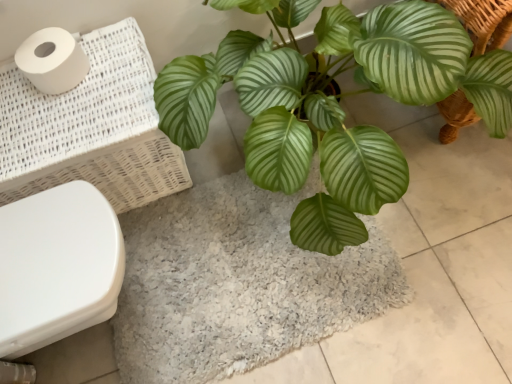
Question: Considering the relative positions of white glossy toilet bowl at lower left and white woven laundry basket at left in the image provided, is white glossy toilet bowl at lower left to the right of white woven laundry basket at left from the viewer's perspective?

Choices:
 (A) yes
 (B) no

Answer: (A)

Question: Can you confirm if white glossy toilet bowl at lower left is shorter than white woven laundry basket at left?

Choices:
 (A) yes
 (B) no

Answer: (A)

Question: From the image's perspective, is white glossy toilet bowl at lower left over white woven laundry basket at left?

Choices:
 (A) no
 (B) yes

Answer: (A)

Question: Could you tell me if white glossy toilet bowl at lower left is turned towards white woven laundry basket at left?

Choices:
 (A) yes
 (B) no

Answer: (B)

Question: Considering the relative sizes of white glossy toilet bowl at lower left and white woven laundry basket at left in the image provided, is white glossy toilet bowl at lower left thinner than white woven laundry basket at left?

Choices:
 (A) yes
 (B) no

Answer: (B)

Question: Considering the positions of white glossy toilet bowl at lower left and white woven laundry basket at left in the image, is white glossy toilet bowl at lower left bigger or smaller than white woven laundry basket at left?

Choices:
 (A) big
 (B) small

Answer: (B)

Question: Would you say white glossy toilet bowl at lower left is to the left or to the right of white woven laundry basket at left in the picture?

Choices:
 (A) left
 (B) right

Answer: (B)

Question: From a real-world perspective, is white glossy toilet bowl at lower left physically located above or below white woven laundry basket at left?

Choices:
 (A) above
 (B) below

Answer: (B)

Question: In terms of width, does white glossy toilet bowl at lower left look wider or thinner when compared to white woven laundry basket at left?

Choices:
 (A) thin
 (B) wide

Answer: (B)

Question: Considering the positions of white woven laundry basket at left and white glossy toilet bowl at lower left in the image, is white woven laundry basket at left taller or shorter than white glossy toilet bowl at lower left?

Choices:
 (A) short
 (B) tall

Answer: (B)

Question: In terms of size, does white woven laundry basket at left appear bigger or smaller than white glossy toilet bowl at lower left?

Choices:
 (A) small
 (B) big

Answer: (B)

Question: In the image, is white woven laundry basket at left positioned in front of or behind white glossy toilet bowl at lower left?

Choices:
 (A) behind
 (B) front

Answer: (A)

Question: From the image's perspective, is white woven laundry basket at left above or below white glossy toilet bowl at lower left?

Choices:
 (A) above
 (B) below

Answer: (A)

Question: Choose the correct answer: Is gray shaggy bath mat at center inside white glossy toilet bowl at lower left or outside it?

Choices:
 (A) outside
 (B) inside

Answer: (A)

Question: Is gray shaggy bath mat at center in front of or behind white glossy toilet bowl at lower left in the image?

Choices:
 (A) front
 (B) behind

Answer: (B)